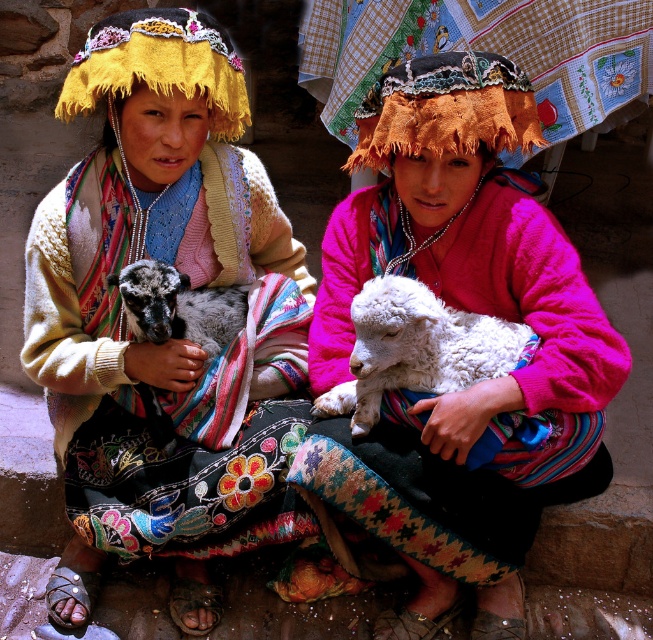
Does white woolen lamb at center have a lesser height compared to white fluffy lamb at center?

No, white woolen lamb at center is not shorter than white fluffy lamb at center.

Find the location of `white woolen lamb at center`. white woolen lamb at center is located at coordinates (466, 305).

How distant is white woolen lamb at center from yellow knitted headdress at upper left?

white woolen lamb at center is 1.04 meters away from yellow knitted headdress at upper left.

Does point (466, 424) come in front of point (82, 49)?

Yes.

At what (x,y) coordinates should I click in order to perform the action: click on white woolen lamb at center. Please return your answer as a coordinate pair (x, y). Looking at the image, I should click on (x=466, y=305).

Is white woolen lamb at center taller than orange woven hat at center?

Yes.

In order to click on white woolen lamb at center in this screenshot , I will do `click(466, 305)`.